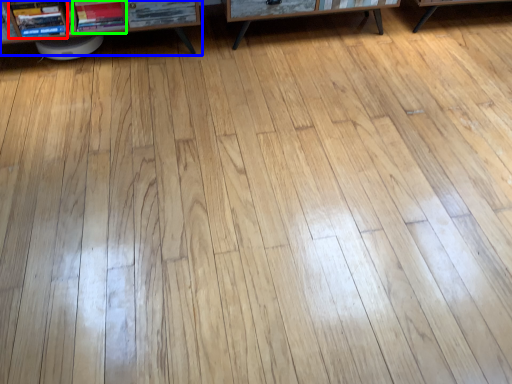
Question: Based on their relative distances, which object is farther from book (highlighted by a red box)? Choose from shelf (highlighted by a blue box) and book (highlighted by a green box).

Choices:
 (A) shelf
 (B) book

Answer: (B)